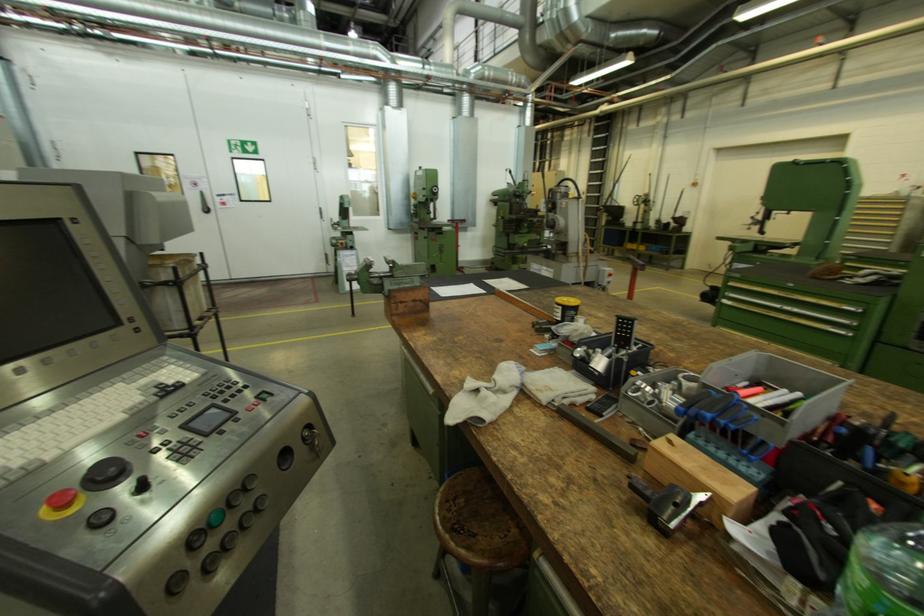
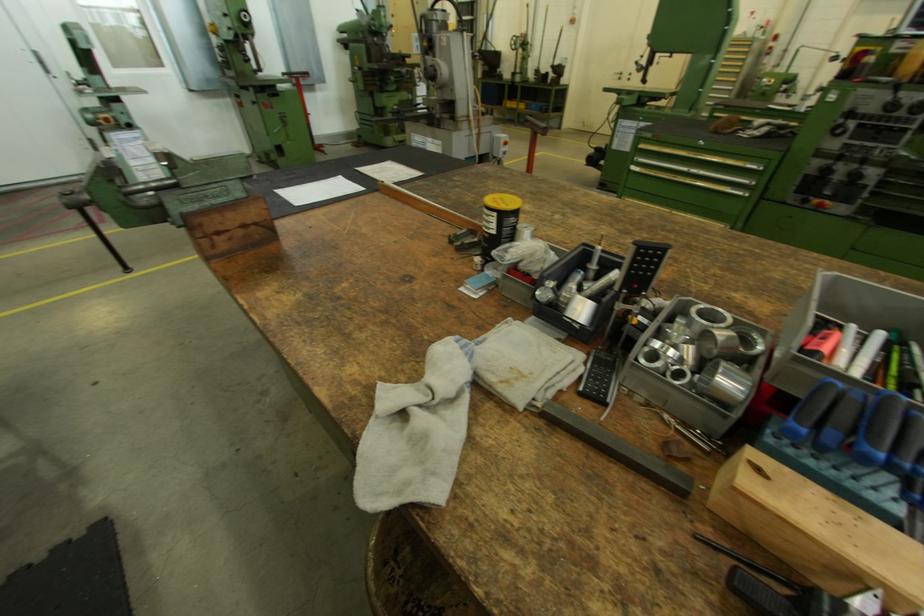
Where in the second image is the point corresponding to point (463, 219) from the first image?

(299, 71)